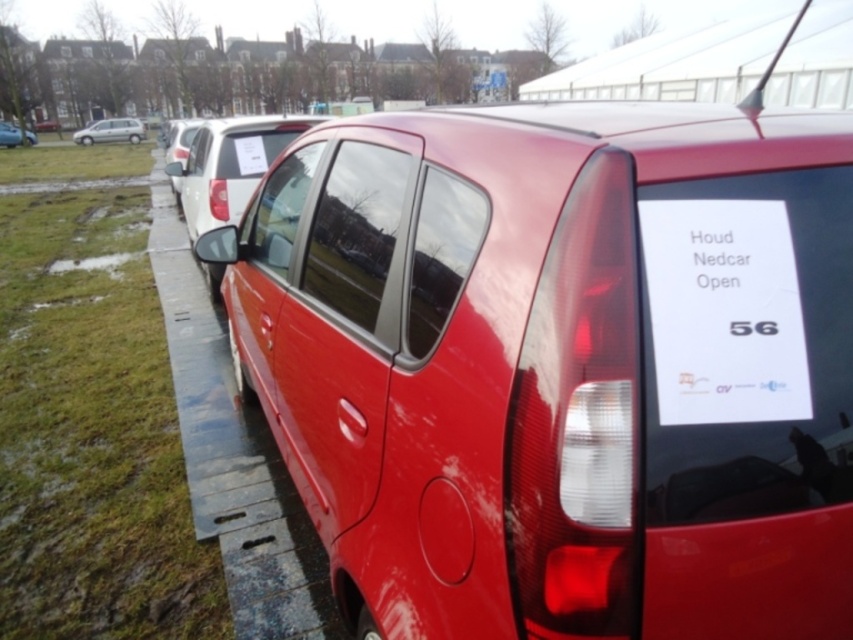
You are standing in front of the red car and want to take a photo of the glossy white van at center and the silver metallic van at upper left. Which van should you move towards to get both in the frame?

You should move towards the silver metallic van at upper left because the glossy white van at center is to the right of it, so positioning yourself closer to the silver metallic van at upper left will allow both vans to be in the frame.

You are a delivery person trying to park a small delivery van that is 1.2 meters tall. You see the metal curb at lower left and the silver metallic van at upper left. Which object is taller? Can your van safely pass under the taller one without hitting it?

The metal curb at lower left is taller than the silver metallic van at upper left. Since your van is 1.2 meters tall and the metal curb is taller, you need to ensure there is enough clearance. However, without knowing the exact height of the curb, it is difficult to determine if the van can safely pass under it. Please check the height of the curb before proceeding.

You are standing in front of the red car and want to place two markers at the coordinates point (194,445) and point (196,168). Which marker will be closer to you?

Point (194,445) is closer to the viewer than point (196,168), so the marker at point (194,445) will be closer to you.